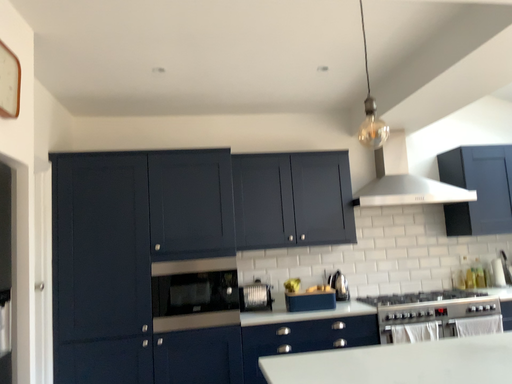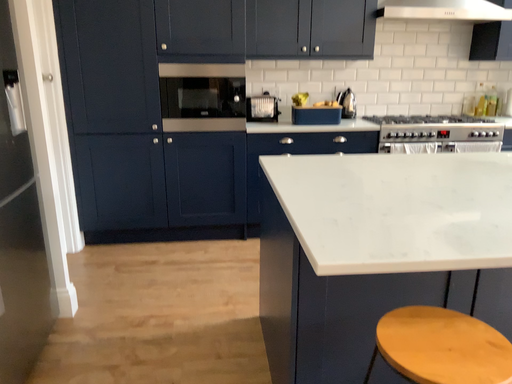
Question: How did the camera likely rotate when shooting the video?

Choices:
 (A) rotated downward
 (B) rotated upward

Answer: (A)